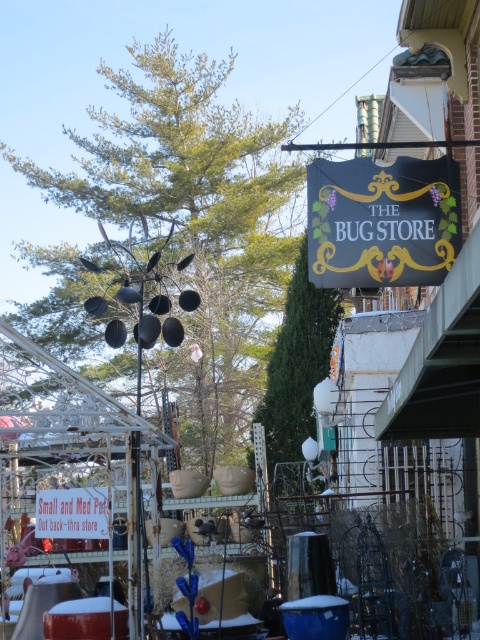
Is black fabric sign at upper center positioned behind red plastic sign at lower left?

No.

Based on the photo, does black fabric sign at upper center appear on the right side of red plastic sign at lower left?

Yes, black fabric sign at upper center is to the right of red plastic sign at lower left.

Is point (440, 189) farther from camera compared to point (60, 490)?

No, it is in front of (60, 490).

The width and height of the screenshot is (480, 640). Find the location of `black fabric sign at upper center`. black fabric sign at upper center is located at coordinates (383, 221).